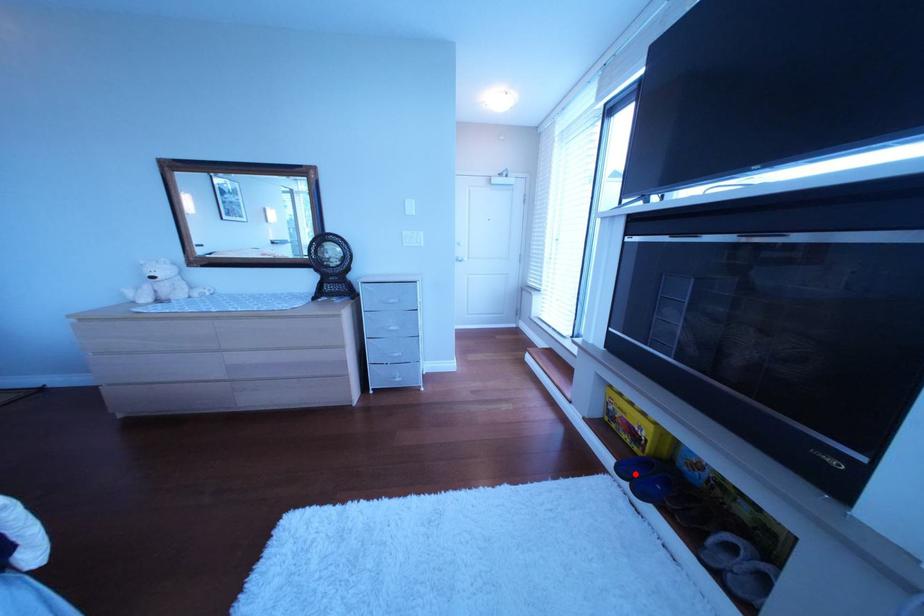
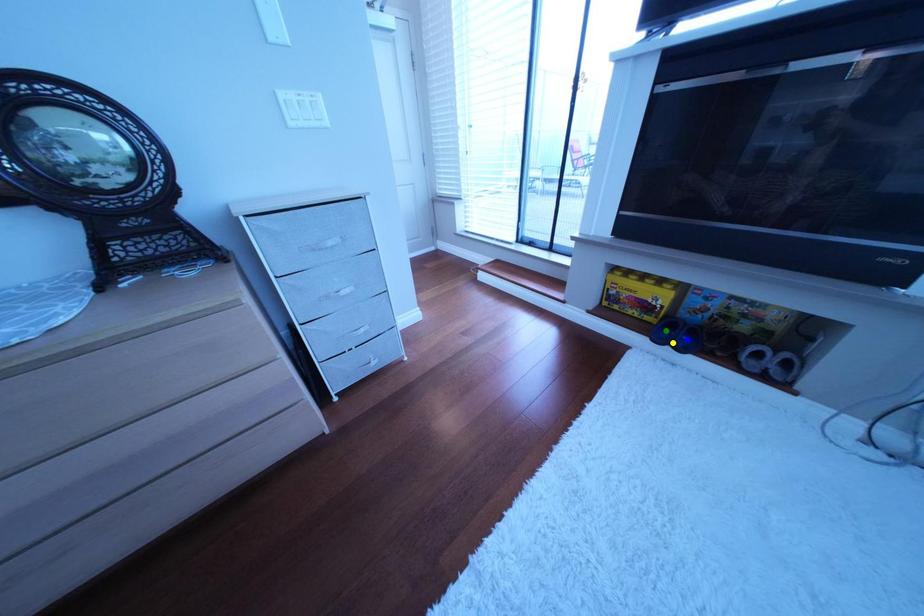
Question: I am providing you with two images of the same scene from different viewpoints. A red point is marked on the first image. You are given multiple points on the second image. Which point in image 2 represents the same 3d spot as the red point in image 1?

Choices:
 (A) blue point
 (B) green point
 (C) yellow point

Answer: (C)